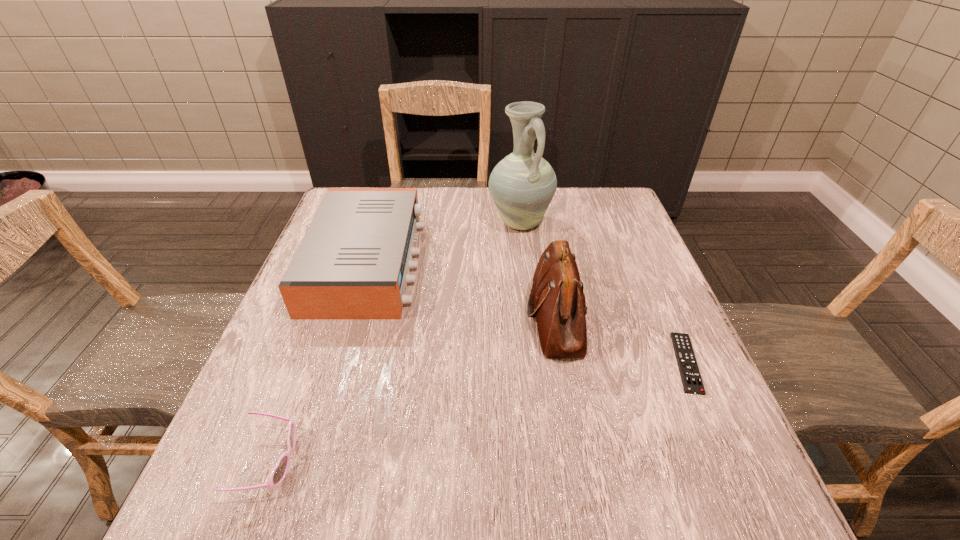
The width and height of the screenshot is (960, 540). In order to click on free space located on the front-facing side of the second shortest object in this screenshot , I will do `click(436, 462)`.

Identify the location of free space located on the left of the rightmost object. (501, 363).

Where is `pitcher that is at the far edge`? pitcher that is at the far edge is located at coordinates (522, 185).

Where is `radio receiver at the far edge`? The height and width of the screenshot is (540, 960). radio receiver at the far edge is located at coordinates pyautogui.click(x=353, y=263).

In order to click on object that is at the near edge in this screenshot , I will do `click(279, 472)`.

Identify the location of radio receiver that is at the left edge. This screenshot has width=960, height=540. (353, 263).

Locate an element on the screen. The image size is (960, 540). sunglasses situated at the left edge is located at coordinates (279, 472).

Find the location of a particular element. The width and height of the screenshot is (960, 540). object located at the right edge is located at coordinates (690, 375).

The width and height of the screenshot is (960, 540). Find the location of `object situated at the far left corner`. object situated at the far left corner is located at coordinates (353, 263).

Where is `object located at the near left corner`? This screenshot has height=540, width=960. object located at the near left corner is located at coordinates (279, 472).